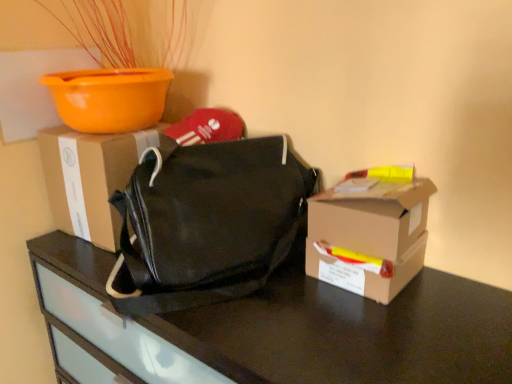
Question: Would you consider black matte bag at center to be distant from matte cardboard box at center, the 1th box viewed from the back?

Choices:
 (A) no
 (B) yes

Answer: (A)

Question: Does black matte bag at center appear on the left side of matte cardboard box at center, the 1th box viewed from the back?

Choices:
 (A) no
 (B) yes

Answer: (A)

Question: Is matte cardboard box at center, arranged as the 2th box when viewed from the right, at the back of black matte bag at center?

Choices:
 (A) yes
 (B) no

Answer: (B)

Question: Can you confirm if black matte bag at center is smaller than matte cardboard box at center, the 1th box viewed from the back?

Choices:
 (A) yes
 (B) no

Answer: (B)

Question: Can you confirm if black matte bag at center is positioned to the right of matte cardboard box at center, arranged as the 2th box when viewed from the right?

Choices:
 (A) no
 (B) yes

Answer: (B)

Question: Is black matte bag at center positioned before matte cardboard box at center, arranged as the 2th box when viewed from the right?

Choices:
 (A) yes
 (B) no

Answer: (A)

Question: Is brown cardboard box at right, placed as the 2th box when sorted from back to front, far from matte cardboard box at center, the second box from the front?

Choices:
 (A) yes
 (B) no

Answer: (B)

Question: Does brown cardboard box at right, which is the 2th box from left to right, have a lesser width compared to matte cardboard box at center, the 1th box viewed from the back?

Choices:
 (A) yes
 (B) no

Answer: (A)

Question: Can you confirm if brown cardboard box at right, the 1th box in the right-to-left sequence, is shorter than matte cardboard box at center, the 1th box viewed from the back?

Choices:
 (A) no
 (B) yes

Answer: (B)

Question: Is brown cardboard box at right, which is the 2th box from left to right, smaller than matte cardboard box at center, the 1th box viewed from the back?

Choices:
 (A) no
 (B) yes

Answer: (B)

Question: Considering the relative positions of brown cardboard box at right, which is the 2th box from left to right, and matte cardboard box at center, the second box from the front, in the image provided, is brown cardboard box at right, which is the 2th box from left to right, to the right of matte cardboard box at center, the second box from the front, from the viewer's perspective?

Choices:
 (A) yes
 (B) no

Answer: (A)

Question: From a real-world perspective, is brown cardboard box at right, which is the 2th box from left to right, below matte cardboard box at center, arranged as the 2th box when viewed from the right?

Choices:
 (A) yes
 (B) no

Answer: (A)

Question: Is orange plastic bowl at upper left looking in the opposite direction of black matte bag at center?

Choices:
 (A) no
 (B) yes

Answer: (A)